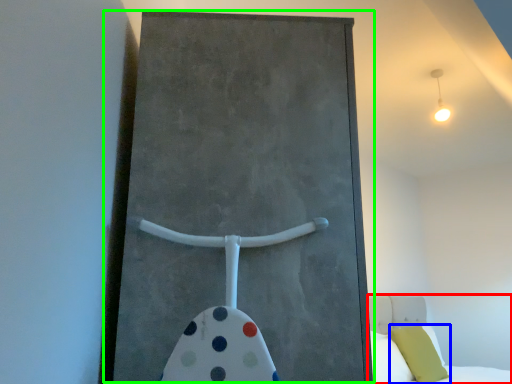
Question: Estimate the real-world distances between objects in this image. Which object is closer to bed (highlighted by a red box), pillow (highlighted by a blue box) or barn door (highlighted by a green box)?

Choices:
 (A) pillow
 (B) barn door

Answer: (A)